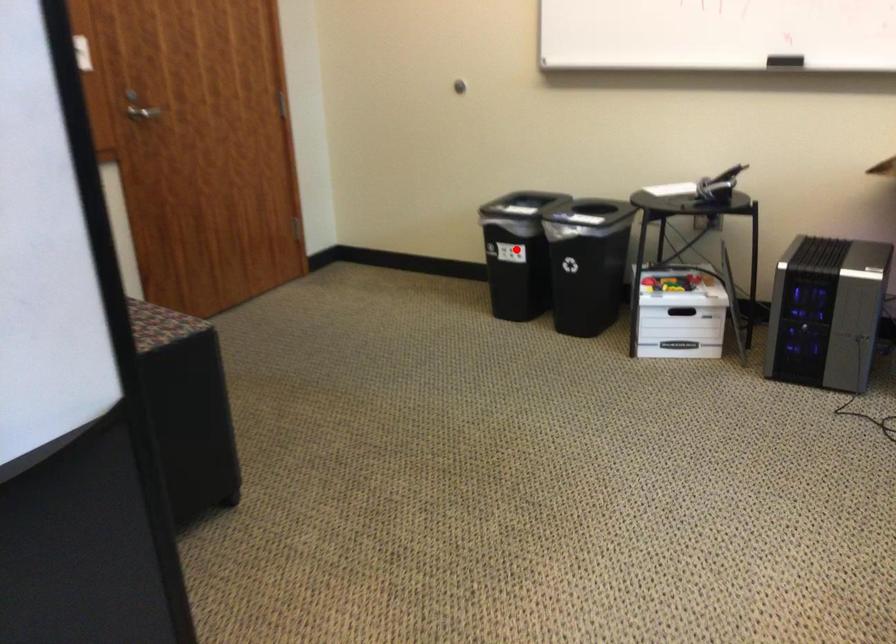
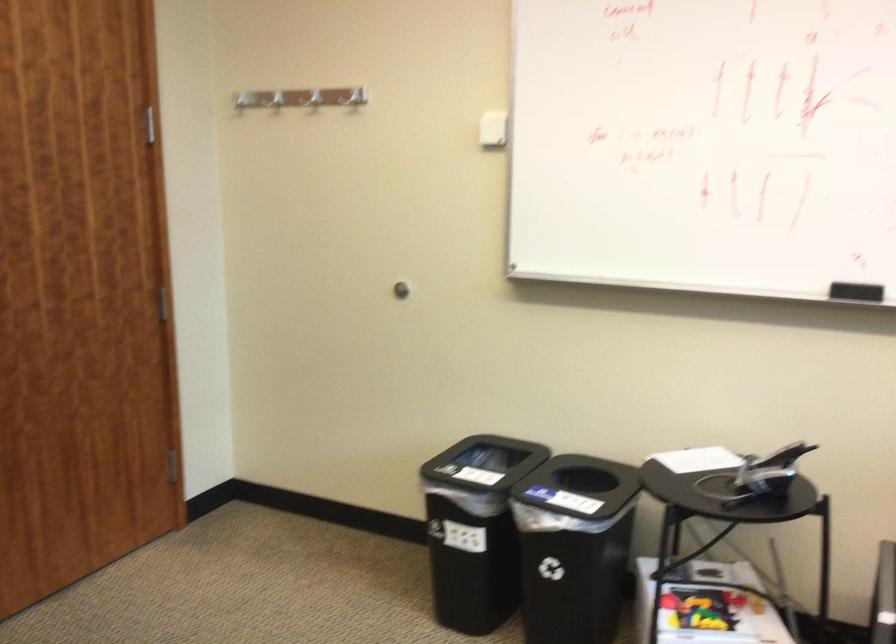
Question: I am providing you with two images of the same scene from different viewpoints. Image1 has a red point marked. In image2, the corresponding 3D location appears at what relative position? Reply with the corresponding letter.

Choices:
 (A) Closer
 (B) Farther

Answer: (A)